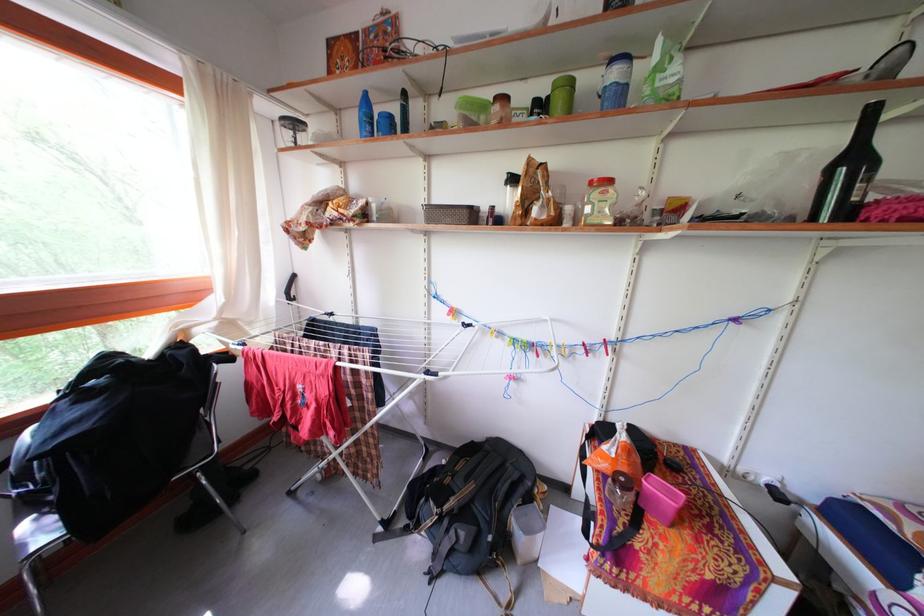
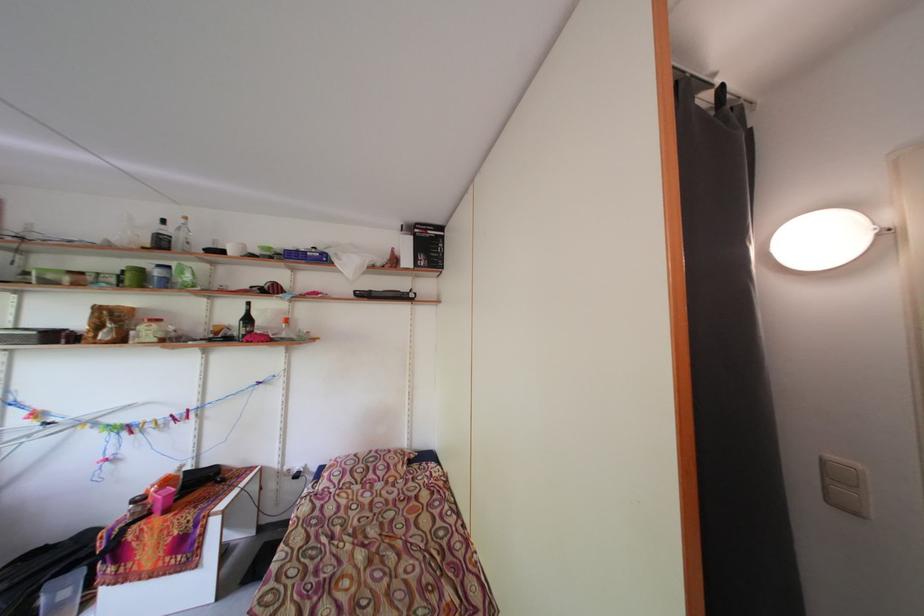
Find the pixel in the second image that matches (x=529, y=90) in the first image.

(127, 265)